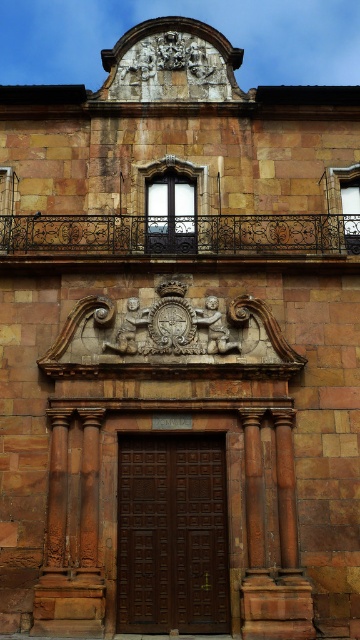
You are a painter standing at the base of the historic building. You want to paint the black wrought iron balcony at upper center but need to ensure your ladder can reach it from the dark brown wood door at center. If your ladder is 15 meters long, will it be sufficient?

The distance between the dark brown wood door at center and the black wrought iron balcony at upper center is 16.61 meters. Since the ladder is only 15 meters long, it will not be sufficient to reach the balcony.

You are an architect evaluating the building facade. You need to determine which object occupies a larger area on the facade between the dark brown wood door at center and the black wrought iron balcony at upper center. Based on the provided information, which one is larger?

The dark brown wood door at center is smaller than the black wrought iron balcony at upper center, so the black wrought iron balcony at upper center occupies a larger area on the facade.